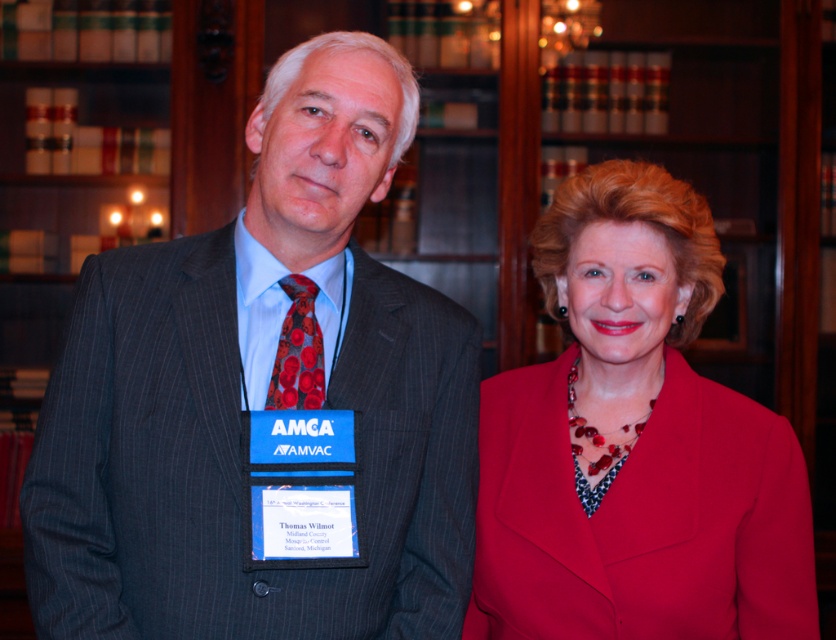
Does gray pinstripe suit at center lie behind red satin tie at center?

No, gray pinstripe suit at center is in front of red satin tie at center.

Consider the image. Who is positioned more to the right, gray pinstripe suit at center or red satin tie at center?

Positioned to the right is gray pinstripe suit at center.

Between point (121, 419) and point (307, 289), which one is positioned in front?

Point (121, 419) is more forward.

Find the location of a particular element. The width and height of the screenshot is (836, 640). gray pinstripe suit at center is located at coordinates click(x=263, y=401).

Between gray pinstripe suit at center and matte red coat at right, which one appears on the right side from the viewer's perspective?

From the viewer's perspective, matte red coat at right appears more on the right side.

Find the location of a particular element. The width and height of the screenshot is (836, 640). gray pinstripe suit at center is located at coordinates (263, 401).

Is point (355, 384) positioned behind point (631, 488)?

No.

I want to click on gray pinstripe suit at center, so click(263, 401).

Where is `matte red coat at right`? matte red coat at right is located at coordinates (635, 444).

Which is in front, point (704, 465) or point (279, 348)?

Positioned in front is point (279, 348).

You are a GUI agent. You are given a task and a screenshot of the screen. Output one action in this format:
    pyautogui.click(x=<x>, y=<y>)
    Task: Click on the matte red coat at right
    
    Given the screenshot: What is the action you would take?
    pyautogui.click(x=635, y=444)